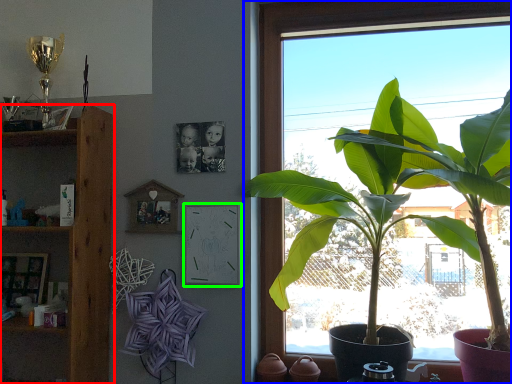
Question: Based on their relative distances, which object is nearer to shelf (highlighted by a red box)? Choose from window (highlighted by a blue box) and picture frame (highlighted by a green box).

Choices:
 (A) window
 (B) picture frame

Answer: (B)